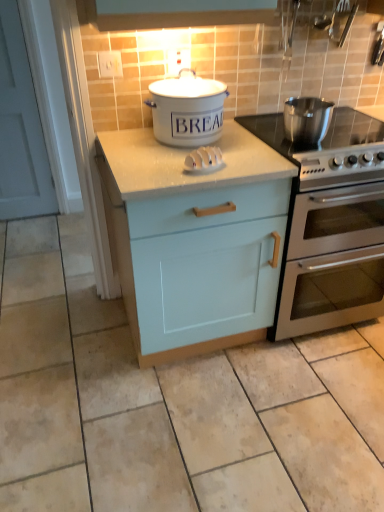
The width and height of the screenshot is (384, 512). In order to click on free space to the left of white plastic knife block at center in this screenshot , I will do `click(153, 169)`.